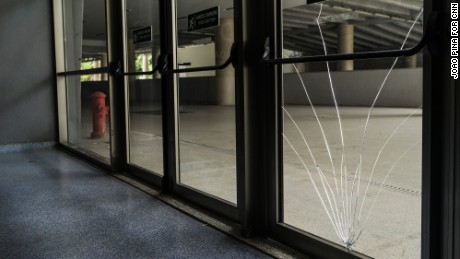
The image size is (460, 259). What are the coordinates of `columns` in the screenshot? It's located at (229, 89), (345, 38), (155, 43), (133, 53), (103, 60), (409, 61).